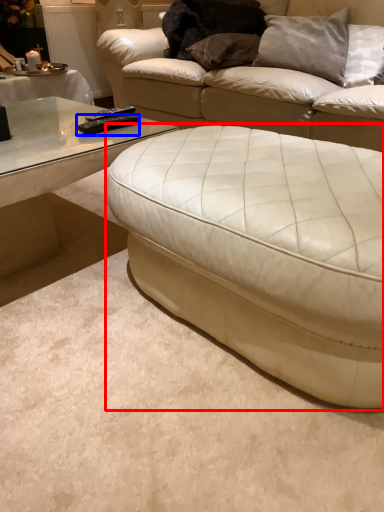
Question: Which point is further to the camera, studio couch (highlighted by a red box) or remote (highlighted by a blue box)?

Choices:
 (A) studio couch
 (B) remote

Answer: (B)